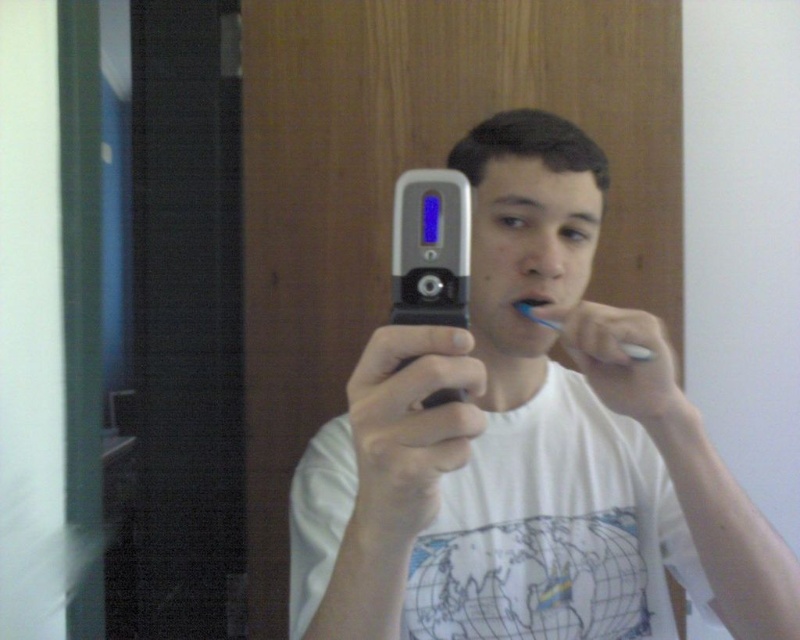
You are trying to take a selfie with your flip phone. You notice a point at coordinates (x=526, y=449) in the image. Is this point likely to be where your flip phone is located?

Yes, the point at coordinates (x=526, y=449) indicates the silver metallic flip phone at center, so this is the location of your flip phone.

You are trying to take a selfie while brushing your teeth. You have a silver metallic flip phone at center and a blue plastic toothbrush at upper center. Which object is closer to your face?

The silver metallic flip phone at center is closer to the viewer than the blue plastic toothbrush at upper center, so the flip phone is closer to your face.

You are a dentist advising a patient on proper brushing techniques. You observe the blue plastic toothbrush at upper center and the matte plastic toothbrush at center in the image. Which toothbrush is located above the other?

The blue plastic toothbrush at upper center is positioned under the matte plastic toothbrush at center, so the matte plastic toothbrush at center is above the blue plastic toothbrush at upper center.